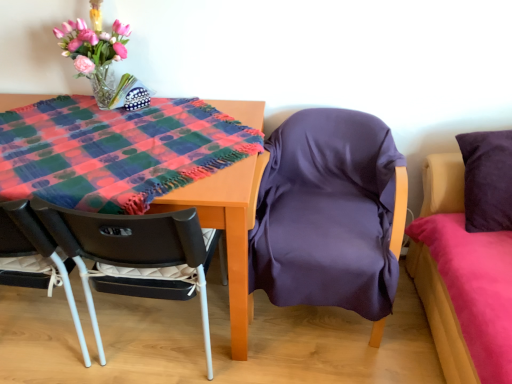
Question: Is wooden table at center positioned beyond the bounds of purple satin chair at center, marked as the first chair in a right-to-left arrangement?

Choices:
 (A) yes
 (B) no

Answer: (A)

Question: Considering the relative sizes of wooden table at center and purple satin chair at center, marked as the first chair in a right-to-left arrangement, in the image provided, is wooden table at center thinner than purple satin chair at center, marked as the first chair in a right-to-left arrangement,?

Choices:
 (A) yes
 (B) no

Answer: (B)

Question: From the image's perspective, does wooden table at center appear lower than purple satin chair at center, marked as the first chair in a right-to-left arrangement?

Choices:
 (A) no
 (B) yes

Answer: (A)

Question: Is wooden table at center positioned behind purple satin chair at center, the 2th chair when ordered from left to right?

Choices:
 (A) yes
 (B) no

Answer: (B)

Question: Would you say purple satin chair at center, marked as the first chair in a right-to-left arrangement, is part of wooden table at center's contents?

Choices:
 (A) yes
 (B) no

Answer: (B)

Question: Could you tell me if wooden table at center is turned towards purple satin chair at center, marked as the first chair in a right-to-left arrangement?

Choices:
 (A) no
 (B) yes

Answer: (A)

Question: Is matte black chair at lower left, which is counted as the 1th chair, starting from the left, completely or partially inside purple satin bed at right?

Choices:
 (A) no
 (B) yes

Answer: (A)

Question: Considering the relative sizes of purple satin bed at right and matte black chair at lower left, which appears as the 2th chair when viewed from the right, in the image provided, is purple satin bed at right smaller than matte black chair at lower left, which appears as the 2th chair when viewed from the right,?

Choices:
 (A) no
 (B) yes

Answer: (A)

Question: Is purple satin bed at right at the right side of matte black chair at lower left, which appears as the 2th chair when viewed from the right?

Choices:
 (A) yes
 (B) no

Answer: (A)

Question: Does purple satin bed at right come behind matte black chair at lower left, which is counted as the 1th chair, starting from the left?

Choices:
 (A) no
 (B) yes

Answer: (A)

Question: From a real-world perspective, does purple satin bed at right sit lower than matte black chair at lower left, which is counted as the 1th chair, starting from the left?

Choices:
 (A) no
 (B) yes

Answer: (A)

Question: Considering the relative positions of purple satin bed at right and matte black chair at lower left, which is counted as the 1th chair, starting from the left, in the image provided, is purple satin bed at right to the left of matte black chair at lower left, which is counted as the 1th chair, starting from the left, from the viewer's perspective?

Choices:
 (A) no
 (B) yes

Answer: (A)

Question: Does wooden table at center have a larger size compared to matte black chair at lower left, which appears as the 2th chair when viewed from the right?

Choices:
 (A) yes
 (B) no

Answer: (B)